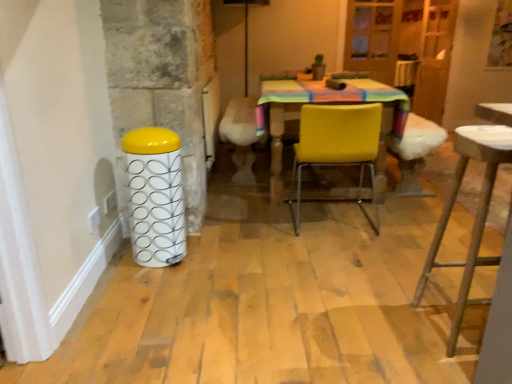
This screenshot has width=512, height=384. Identify the location of vacant area that lies between yellow matte chair at center and white glossy bar stool at left. (253, 238).